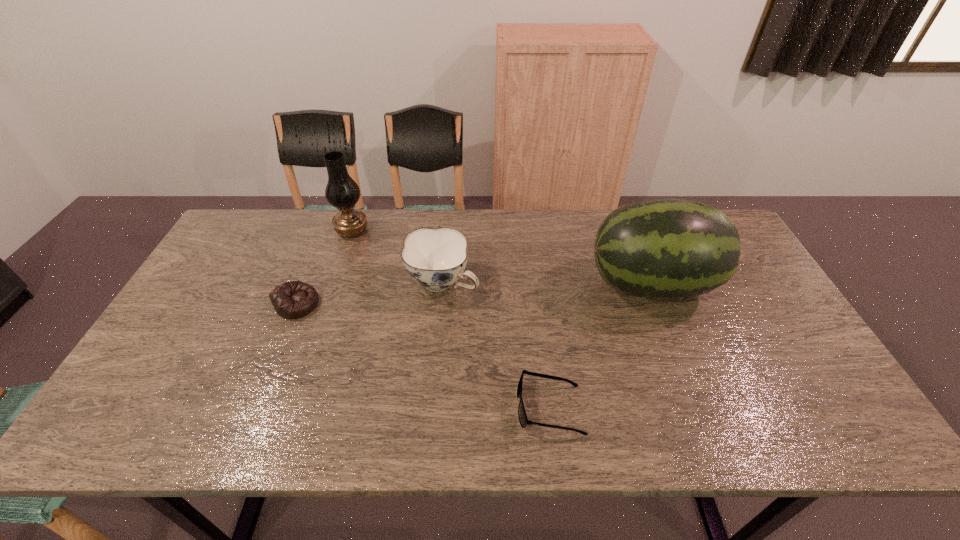
At what (x,y) coordinates should I click in order to perform the action: click on free space located on the back of the beanbag. Please return your answer as a coordinate pair (x, y). This screenshot has height=540, width=960. Looking at the image, I should click on (323, 241).

What are the coordinates of `free spot located on the front-facing side of the sunglasses` in the screenshot? It's located at (371, 408).

You are a GUI agent. You are given a task and a screenshot of the screen. Output one action in this format:
    pyautogui.click(x=<x>, y=<y>)
    Task: Click on the vacant space located on the front-facing side of the sunglasses
    This screenshot has height=540, width=960.
    Given the screenshot: What is the action you would take?
    pyautogui.click(x=422, y=408)

Locate an element on the screen. This screenshot has height=540, width=960. vacant position located on the front-facing side of the sunglasses is located at coordinates (401, 408).

What are the coordinates of `oil lamp positioned at the far edge` in the screenshot? It's located at (342, 192).

Locate an element on the screen. watermelon that is at the far edge is located at coordinates (663, 248).

At what (x,y) coordinates should I click in order to perform the action: click on object situated at the near edge. Please return your answer as a coordinate pair (x, y). This screenshot has width=960, height=540. Looking at the image, I should click on (523, 420).

This screenshot has height=540, width=960. I want to click on object located at the right edge, so click(x=663, y=248).

The height and width of the screenshot is (540, 960). Find the location of `object situated at the far right corner`. object situated at the far right corner is located at coordinates (663, 248).

The width and height of the screenshot is (960, 540). Identify the location of free space at the far edge of the desktop. (359, 240).